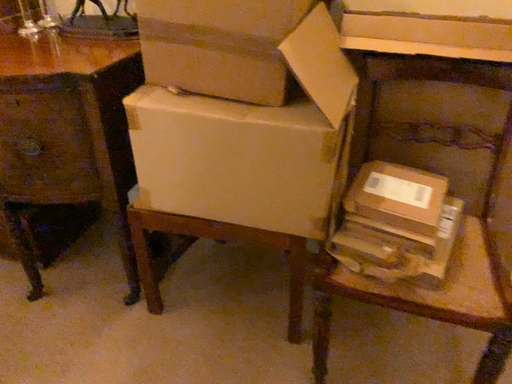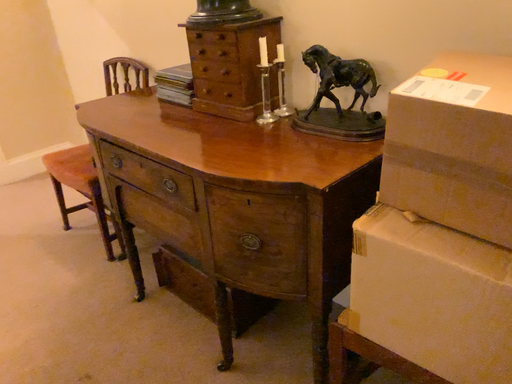
Question: How did the camera likely rotate when shooting the video?

Choices:
 (A) rotated downward
 (B) rotated upward

Answer: (B)